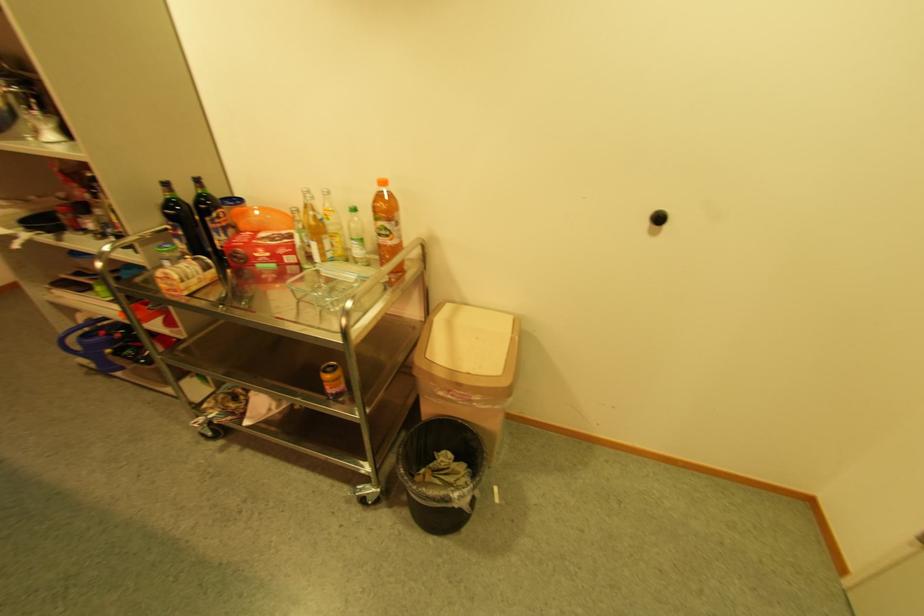
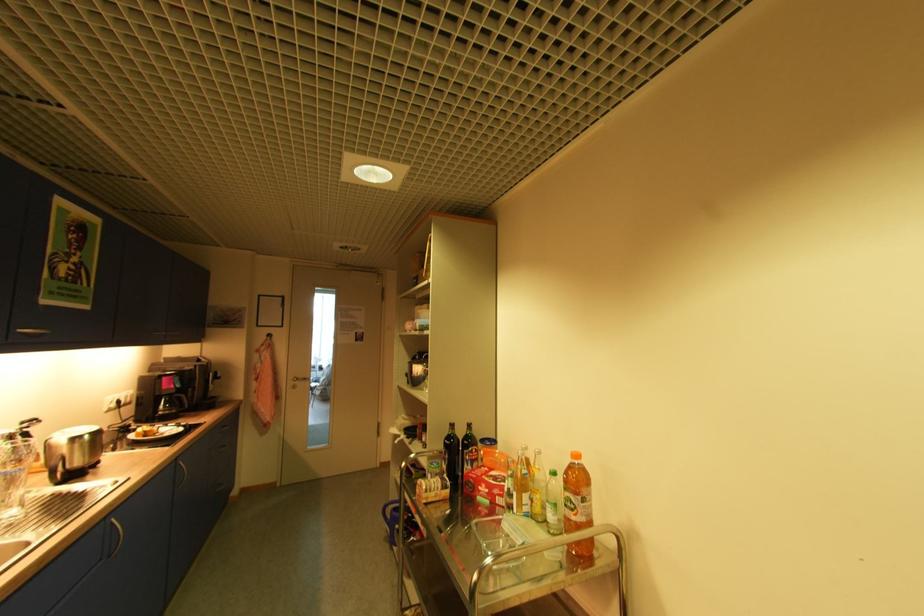
Where in the second image is the point corresponding to point (91, 337) from the first image?

(400, 509)